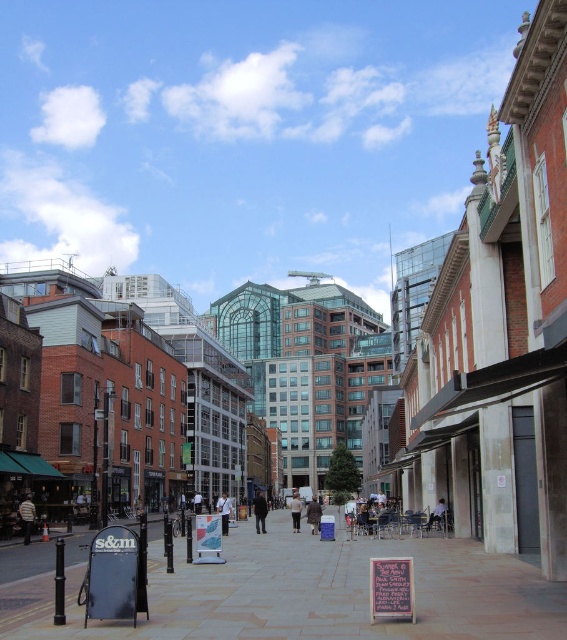
You are a fashion designer observing a crowd in an urban setting. You notice two individuals wearing a dark gray jacket at center and a light beige sweater at center. Which clothing item appears shorter in height?

The dark gray jacket at center has a lesser height compared to the light beige sweater at center, so the dark gray jacket at center appears shorter in height.

You are a photographer standing in the urban scene and want to take a photo that includes both the light brown leather jacket at center and the light blue shirt at center. Which one should you focus on first to ensure both are in sharp focus?

You should focus on the light brown leather jacket at center first because it is closer to the viewer than the light blue shirt at center. By focusing on the closer object, the farther one will also be in focus due to the depth of field.

You are a fashion designer observing a passerby wearing a light brown leather jacket at center and a light blue shirt at center. Which clothing item is positioned higher on the person?

The light brown leather jacket at center is positioned higher than the light blue shirt at center, as it is located above it.